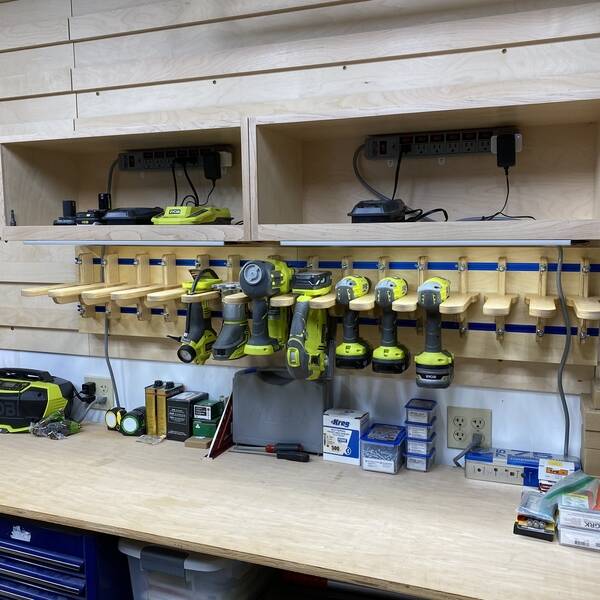
You are a GUI agent. You are given a task and a screenshot of the screen. Output one action in this format:
    pyautogui.click(x=<x>, y=<y>)
    Task: Click on the receptacle
    
    Given the screenshot: What is the action you would take?
    pyautogui.click(x=469, y=414), pyautogui.click(x=99, y=385)